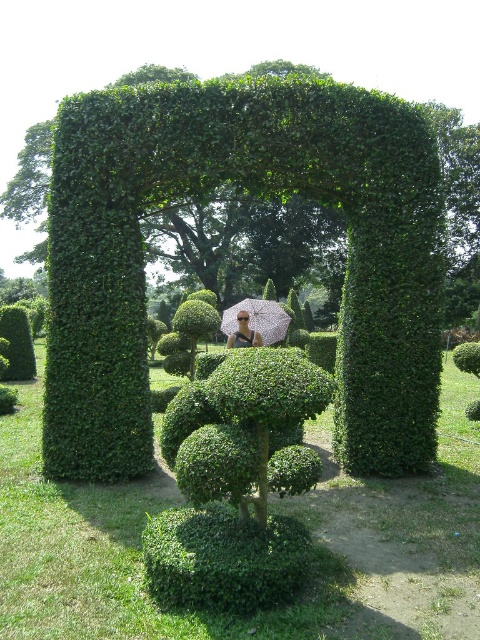
Question: Does pink fabric umbrella at center appear on the right side of matte black umbrella at center?

Choices:
 (A) yes
 (B) no

Answer: (A)

Question: Is pink fabric umbrella at center positioned behind matte black umbrella at center?

Choices:
 (A) yes
 (B) no

Answer: (A)

Question: Does pink fabric umbrella at center have a greater width compared to matte black umbrella at center?

Choices:
 (A) yes
 (B) no

Answer: (A)

Question: Which object appears closest to the camera in this image?

Choices:
 (A) pink fabric umbrella at center
 (B) matte black umbrella at center
 (C) green leafy bush at center

Answer: (B)

Question: Which of these objects is positioned closest to the matte black umbrella at center?

Choices:
 (A) green leafy bush at center
 (B) pink fabric umbrella at center

Answer: (B)

Question: Which object is closer to the camera taking this photo?

Choices:
 (A) green leafy bush at center
 (B) matte black umbrella at center
 (C) pink fabric umbrella at center

Answer: (B)